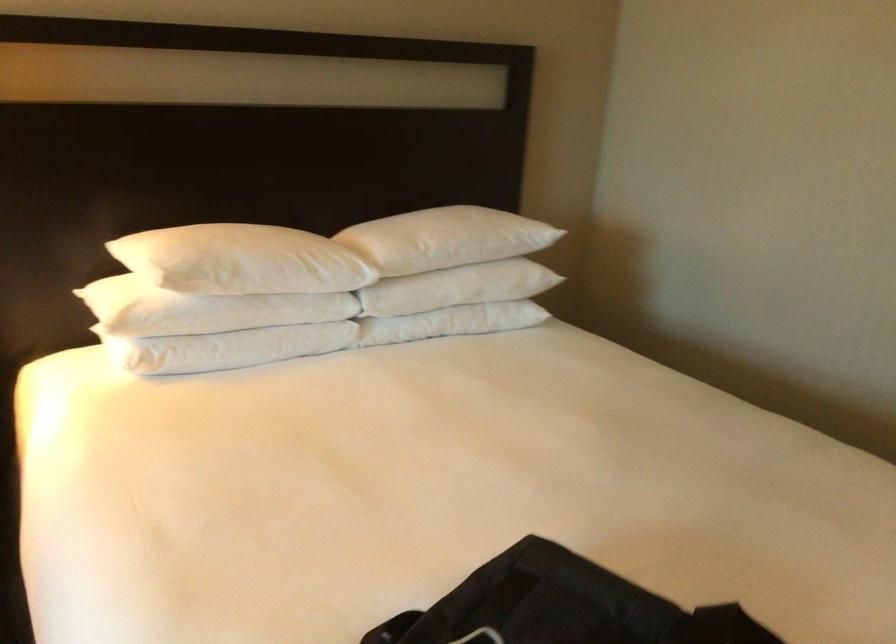
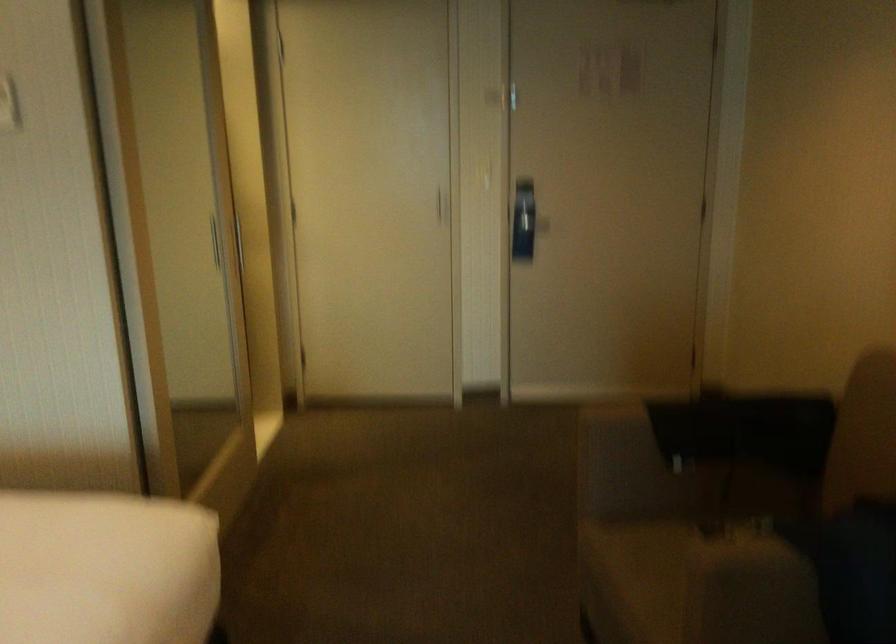
Question: The camera is either moving clockwise (left) or counter-clockwise (right) around the object. The first image is from the beginning of the video and the second image is from the end. Is the camera moving left or right when shooting the video?

Choices:
 (A) Left
 (B) Right

Answer: (A)